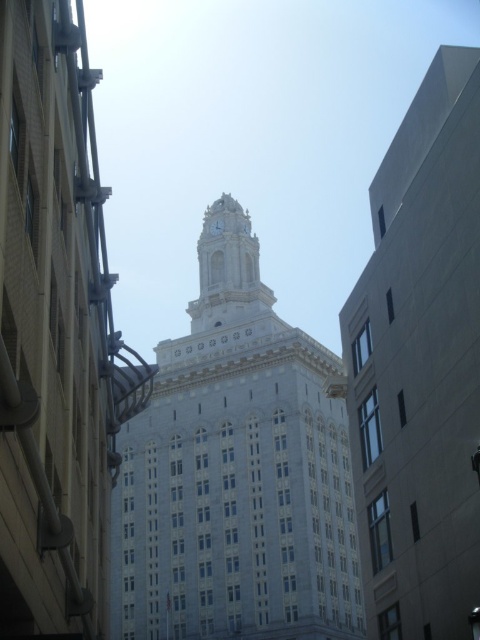
You are standing in front of the grand building with the clock tower. You notice two points marked on the facade. The first point is at coordinates point (x=177, y=387) and the second is at point (x=216, y=228). Which of these points is closer to you as you face the building?

Point (x=177, y=387) is in front of point (x=216, y=228), so it is closer to you as you face the building.

You are standing in front of the grand building and want to reach the point marked at coordinates point (175, 497). If your maximum comfortable walking distance is 250 feet, will you be able to reach it without feeling too tired?

The point (175, 497) is 258.75 feet away from the viewer, which exceeds your maximum comfortable walking distance of 250 feet. Therefore, you may feel tired if you try to reach it.